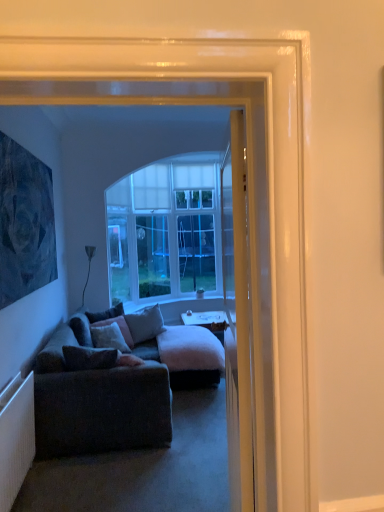
What is the approximate height of velvet gray pillow at center, marked as the fourth pillow in a back-to-front arrangement?

The height of velvet gray pillow at center, marked as the fourth pillow in a back-to-front arrangement, is 20.35 centimeters.

I want to click on dark blue textured painting at upper left, so click(25, 223).

Describe the element at coordinates (145, 324) in the screenshot. The height and width of the screenshot is (512, 384). I see `gray fabric pillow at center, positioned as the third pillow in front-to-back order` at that location.

You are a GUI agent. You are given a task and a screenshot of the screen. Output one action in this format:
    pyautogui.click(x=<x>, y=<y>)
    Task: Click on the white glossy desk at center
    This screenshot has width=384, height=512.
    Given the screenshot: What is the action you would take?
    pyautogui.click(x=208, y=322)

Are dark blue textured painting at upper left and white glossy door at center far apart?

dark blue textured painting at upper left is far away from white glossy door at center.

Is point (33, 190) farther from camera compared to point (249, 450)?

Yes, point (33, 190) is farther from viewer.

How different are the orientations of dark blue textured painting at upper left and white glossy door at center in degrees?

The angular difference between dark blue textured painting at upper left and white glossy door at center is 172 degrees.

In the image, there is a dark blue textured painting at upper left. At what (x,y) coordinates should I click in order to perform the action: click on door below it (from a real-world perspective). Please return your answer as a coordinate pair (x, y). Image resolution: width=384 pixels, height=512 pixels. Looking at the image, I should click on (237, 318).

You are a GUI agent. You are given a task and a screenshot of the screen. Output one action in this format:
    pyautogui.click(x=<x>, y=<y>)
    Task: Click on the 3rd pillow directly beneath the white glossy door at center (from a real-world perspective)
    This screenshot has width=384, height=512.
    Given the screenshot: What is the action you would take?
    pyautogui.click(x=145, y=324)

Does gray fabric pillow at center, the second pillow viewed from the back, lie in front of white glossy door at center?

That is False.

Can you confirm if gray fabric pillow at center, positioned as the third pillow in front-to-back order, is positioned to the left of white glossy door at center?

Yes, gray fabric pillow at center, positioned as the third pillow in front-to-back order, is to the left of white glossy door at center.

Does gray fabric pillow at center, the second pillow viewed from the back, have a smaller size compared to white glossy door at center?

Yes.

Is velvet gray pillow at center, marked as the fourth pillow in a back-to-front arrangement, positioned with its back to gray fabric pillow at center, the second pillow viewed from the back?

No, velvet gray pillow at center, marked as the fourth pillow in a back-to-front arrangement, is not facing the opposite direction of gray fabric pillow at center, the second pillow viewed from the back.

From the image's perspective, is velvet gray pillow at center, marked as the fourth pillow in a back-to-front arrangement, positioned above or below gray fabric pillow at center, the second pillow viewed from the back?

Based on their image positions, velvet gray pillow at center, marked as the fourth pillow in a back-to-front arrangement, is located beneath gray fabric pillow at center, the second pillow viewed from the back.

Can you confirm if velvet gray pillow at center, which is the first pillow in front-to-back order, is shorter than gray fabric pillow at center, the second pillow viewed from the back?

Correct, velvet gray pillow at center, which is the first pillow in front-to-back order, is not as tall as gray fabric pillow at center, the second pillow viewed from the back.

From a real-world perspective, which is physically above, velvet gray pillow at center, marked as the fourth pillow in a back-to-front arrangement, or gray fabric pillow at center, the second pillow viewed from the back?

velvet gray pillow at center, marked as the fourth pillow in a back-to-front arrangement.

From a real-world perspective, is white glossy door at center below white textured radiator at lower left?

Incorrect, from a real-world perspective, white glossy door at center is higher than white textured radiator at lower left.

Considering the sizes of white glossy door at center and white textured radiator at lower left in the image, is white glossy door at center wider or thinner than white textured radiator at lower left?

white glossy door at center is wider than white textured radiator at lower left.

Is white glossy door at center facing towards white textured radiator at lower left?

Yes, white glossy door at center faces towards white textured radiator at lower left.

This screenshot has height=512, width=384. What are the coordinates of `door above the white textured radiator at lower left (from a real-world perspective)` in the screenshot? It's located at (237, 318).

From a real-world perspective, which object rests below the other?

In real-world perspective, white textured radiator at lower left is lower.

From the image's perspective, is white textured radiator at lower left located beneath velvet cushion at center, the 2th pillow viewed from the front?

Correct, white textured radiator at lower left appears lower than velvet cushion at center, the 2th pillow viewed from the front, in the image.

Could you tell me if white textured radiator at lower left is turned towards velvet cushion at center, the 2th pillow viewed from the front?

No, white textured radiator at lower left is not oriented towards velvet cushion at center, the 2th pillow viewed from the front.

In the scene shown: Considering the sizes of objects white textured radiator at lower left and velvet cushion at center, the third pillow in the back-to-front sequence, in the image provided, who is bigger, white textured radiator at lower left or velvet cushion at center, the third pillow in the back-to-front sequence,?

velvet cushion at center, the third pillow in the back-to-front sequence, is bigger.

Is white glossy desk at center taller than white textured radiator at lower left?

Incorrect, the height of white glossy desk at center is not larger of that of white textured radiator at lower left.

Is point (189, 318) farther from camera compared to point (22, 448)?

Yes, point (189, 318) is behind point (22, 448).

From a real-world perspective, is white glossy desk at center located higher than white textured radiator at lower left?

Actually, white glossy desk at center is physically below white textured radiator at lower left in the real world.

What are the coordinates of `pillow in front of the velvet cushion at center, the third pillow in the back-to-front sequence` in the screenshot? It's located at (89, 358).

Looking at their sizes, would you say velvet gray pillow at center, which is the first pillow in front-to-back order, is wider or thinner than velvet cushion at center, the third pillow in the back-to-front sequence?

velvet gray pillow at center, which is the first pillow in front-to-back order, is wider than velvet cushion at center, the third pillow in the back-to-front sequence.

Based on the photo, is velvet gray pillow at center, which is the first pillow in front-to-back order, looking in the opposite direction of velvet cushion at center, the third pillow in the back-to-front sequence?

velvet gray pillow at center, which is the first pillow in front-to-back order, is not turned away from velvet cushion at center, the third pillow in the back-to-front sequence.

Can you see velvet gray pillow at center, marked as the fourth pillow in a back-to-front arrangement, touching velvet cushion at center, the third pillow in the back-to-front sequence?

velvet gray pillow at center, marked as the fourth pillow in a back-to-front arrangement, and velvet cushion at center, the third pillow in the back-to-front sequence, are not in contact.

Find the location of a particular element. picture frame above the white glossy door at center (from a real-world perspective) is located at coordinates (25, 223).

The height and width of the screenshot is (512, 384). Identify the location of door located in front of the gray fabric pillow at center, positioned as the third pillow in front-to-back order. (237, 318).

From the picture: Looking at the image, which one is located further to dark blue textured painting at upper left, white textured radiator at lower left or white glossy desk at center?

The object further to dark blue textured painting at upper left is white glossy desk at center.

Considering their positions, is white glossy desk at center positioned further to velvet cushion at center, the third pillow in the back-to-front sequence, than velvet gray pillow at center, which is the 1th pillow from back to front?

Among the two, white glossy desk at center is located further to velvet cushion at center, the third pillow in the back-to-front sequence.

Considering their positions, is white glossy desk at center positioned closer to velvet gray pillow at center, which is counted as the fourth pillow, starting from the front, than velvet gray pillow at center, which is the first pillow in front-to-back order?

white glossy desk at center.

Looking at the image, which one is located further to gray fabric pillow at center, positioned as the third pillow in front-to-back order, velvet gray pillow at center, which is counted as the fourth pillow, starting from the front, or white glossy door at center?

white glossy door at center is positioned further to the anchor gray fabric pillow at center, positioned as the third pillow in front-to-back order.

Based on their spatial positions, is white glossy desk at center or dark gray fabric couch at lower left closer to velvet cushion at center, the third pillow in the back-to-front sequence?

dark gray fabric couch at lower left lies closer to velvet cushion at center, the third pillow in the back-to-front sequence, than the other object.

Considering their positions, is gray fabric pillow at center, positioned as the third pillow in front-to-back order, positioned closer to velvet cushion at center, the 2th pillow viewed from the front, than white glossy desk at center?

A: gray fabric pillow at center, positioned as the third pillow in front-to-back order, lies closer to velvet cushion at center, the 2th pillow viewed from the front, than the other object.

When comparing their distances from white textured radiator at lower left, does white glossy desk at center or white glossy door at center seem further?

The object further to white textured radiator at lower left is white glossy desk at center.

Which object lies further to the anchor point dark gray fabric couch at lower left, white glossy door at center or white glossy desk at center?

The object further to dark gray fabric couch at lower left is white glossy desk at center.

Locate an element on the screen. The width and height of the screenshot is (384, 512). studio couch between white textured radiator at lower left and velvet gray pillow at center, which is the 1th pillow from back to front, in the front-back direction is located at coordinates (116, 388).

Locate an element on the screen. The width and height of the screenshot is (384, 512). radiator located between white glossy door at center and white glossy desk at center in the depth direction is located at coordinates (16, 437).

The height and width of the screenshot is (512, 384). Find the location of `picture frame between white glossy door at center and white glossy desk at center from front to back`. picture frame between white glossy door at center and white glossy desk at center from front to back is located at coordinates (25, 223).

The image size is (384, 512). I want to click on picture frame between white glossy door at center and dark gray fabric couch at lower left in the front-back direction, so click(x=25, y=223).